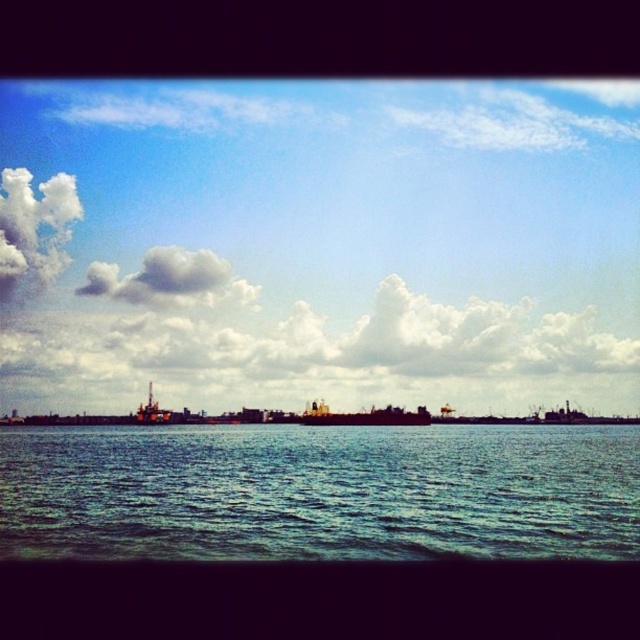
You are standing at the point marked by point (320, 492). What is the color of the surface you are currently standing on?

The point (320, 492) marks blue water at center, so the surface you are standing on is blue water at center.